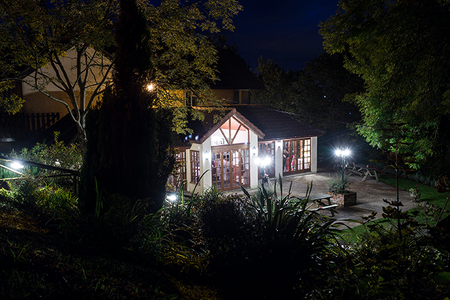
Point to visible where you'd enter the house in the image. Your answer should be formatted as a list of tuples, i.e. [(x1, y1), (x2, y2), ...], where each tuple contains the x and y coordinates of a point satisfying the conditions above.

[(231, 175)]